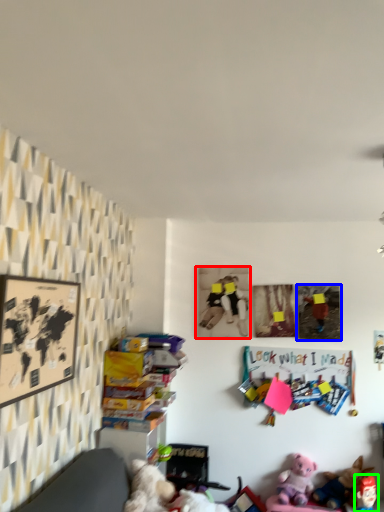
Question: Estimate the real-world distances between objects in this image. Which object is closer to picture frame (highlighted by a red box), picture frame (highlighted by a blue box) or toy (highlighted by a green box)?

Choices:
 (A) picture frame
 (B) toy

Answer: (A)